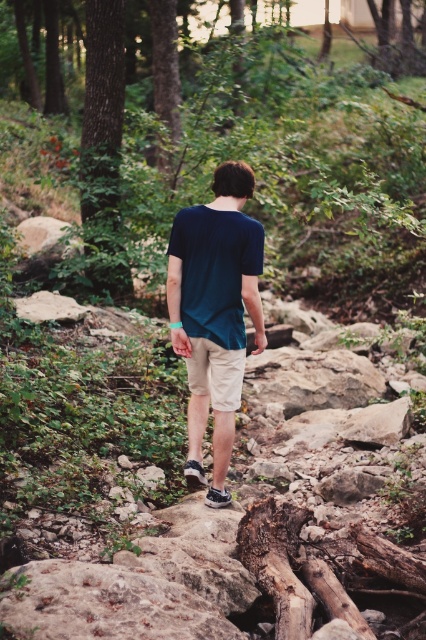
Is the position of dark blue cotton shirt at center more distant than that of khaki cotton shorts at center?

No, dark blue cotton shirt at center is closer to the viewer.

Measure the distance from dark blue cotton shirt at center to khaki cotton shorts at center.

6.81 inches

Where is `dark blue cotton shirt at center`? This screenshot has width=426, height=640. dark blue cotton shirt at center is located at coordinates (215, 312).